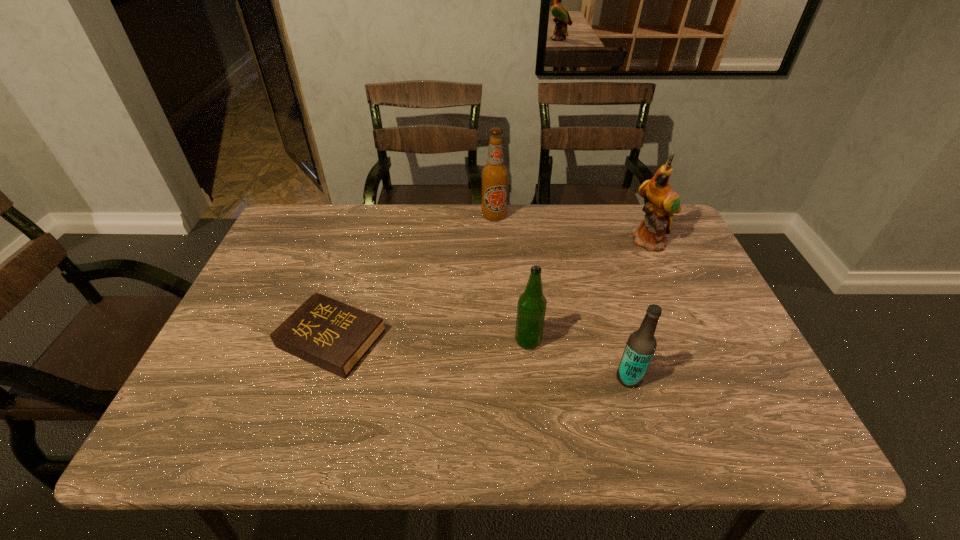
Identify which beer bottle is the second nearest to the second nearest beer bottle. Please provide its 2D coordinates. Your answer should be formatted as a tuple, i.e. [(x, y)], where the tuple contains the x and y coordinates of a point satisfying the conditions above.

[(494, 174)]

Find the location of a particular element. The width and height of the screenshot is (960, 540). beer bottle identified as the closest to the second object from right to left is located at coordinates (531, 309).

Find the location of a particular element. vacant space that satisfies the following two spatial constraints: 1. on the front-facing side of the fourth nearest object; 2. on the label of the second nearest beer bottle is located at coordinates (696, 341).